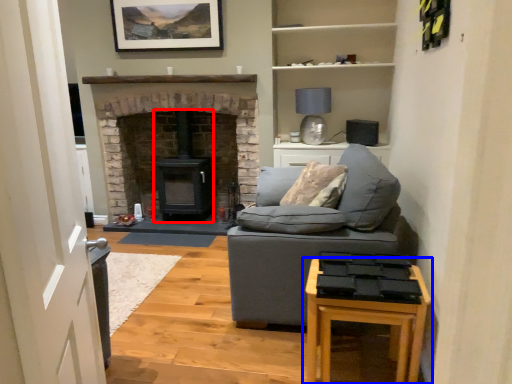
Question: Which of the following is the farthest to the observer, wood burning stove (highlighted by a red box) or table (highlighted by a blue box)?

Choices:
 (A) wood burning stove
 (B) table

Answer: (A)